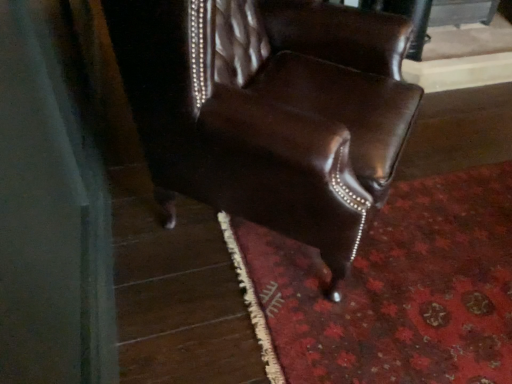
Question: From the image's perspective, is shiny brown leather chair at center positioned above or below floral carpet at lower right?

Choices:
 (A) below
 (B) above

Answer: (B)

Question: Choose the correct answer: Is shiny brown leather chair at center inside floral carpet at lower right or outside it?

Choices:
 (A) outside
 (B) inside

Answer: (A)

Question: In the image, is shiny brown leather chair at center positioned in front of or behind floral carpet at lower right?

Choices:
 (A) behind
 (B) front

Answer: (B)

Question: In terms of width, does floral carpet at lower right look wider or thinner when compared to shiny brown leather chair at center?

Choices:
 (A) wide
 (B) thin

Answer: (A)

Question: From the image's perspective, is floral carpet at lower right above or below shiny brown leather chair at center?

Choices:
 (A) above
 (B) below

Answer: (B)

Question: In terms of height, does floral carpet at lower right look taller or shorter compared to shiny brown leather chair at center?

Choices:
 (A) short
 (B) tall

Answer: (A)

Question: Visually, is floral carpet at lower right positioned to the left or to the right of shiny brown leather chair at center?

Choices:
 (A) right
 (B) left

Answer: (A)